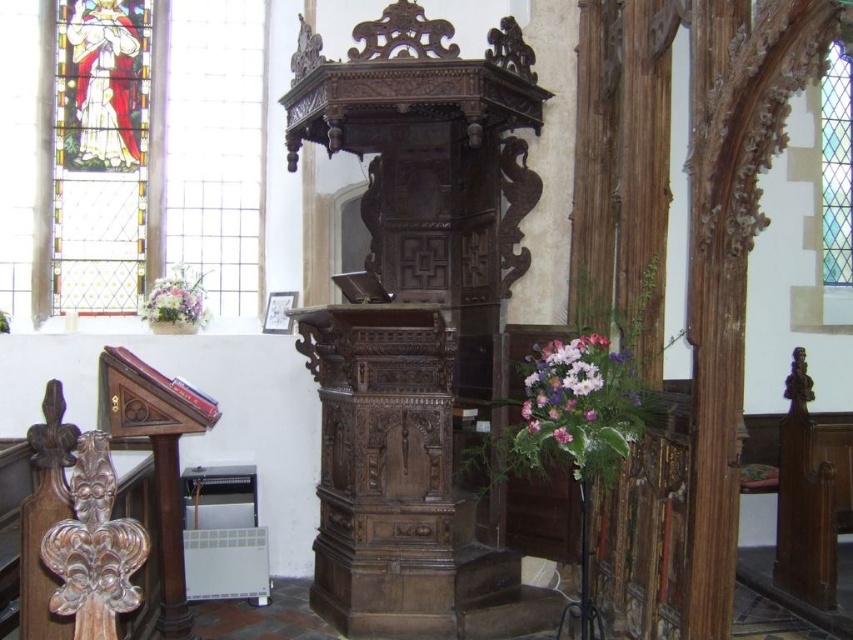
Which of these two, dark brown wood pulpit at center or pink floral bouquet at center, stands shorter?

pink floral bouquet at center is shorter.

Is dark brown wood pulpit at center thinner than pink floral bouquet at center?

No.

Identify the location of dark brown wood pulpit at center. pos(415,321).

Between dark brown wood pulpit at center and stained glass figure at upper left, which one appears on the left side from the viewer's perspective?

Positioned to the left is stained glass figure at upper left.

Is dark brown wood pulpit at center bigger than stained glass figure at upper left?

Indeed, dark brown wood pulpit at center has a larger size compared to stained glass figure at upper left.

Between point (376, 74) and point (138, 241), which one is positioned in front?

Point (376, 74) is more forward.

At what (x,y) coordinates should I click in order to perform the action: click on dark brown wood pulpit at center. Please return your answer as a coordinate pair (x, y). Image resolution: width=853 pixels, height=640 pixels. Looking at the image, I should click on (415, 321).

Is stained glass figure at upper left below pink floral bouquet at center?

No.

Can you confirm if stained glass figure at upper left is bigger than pink floral bouquet at center?

Yes.

This screenshot has width=853, height=640. I want to click on stained glass figure at upper left, so click(x=161, y=156).